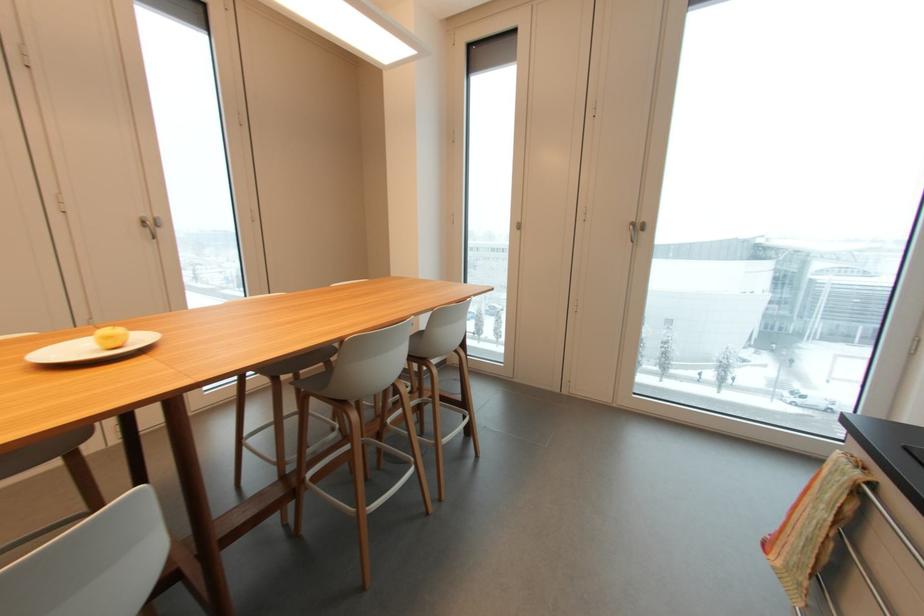
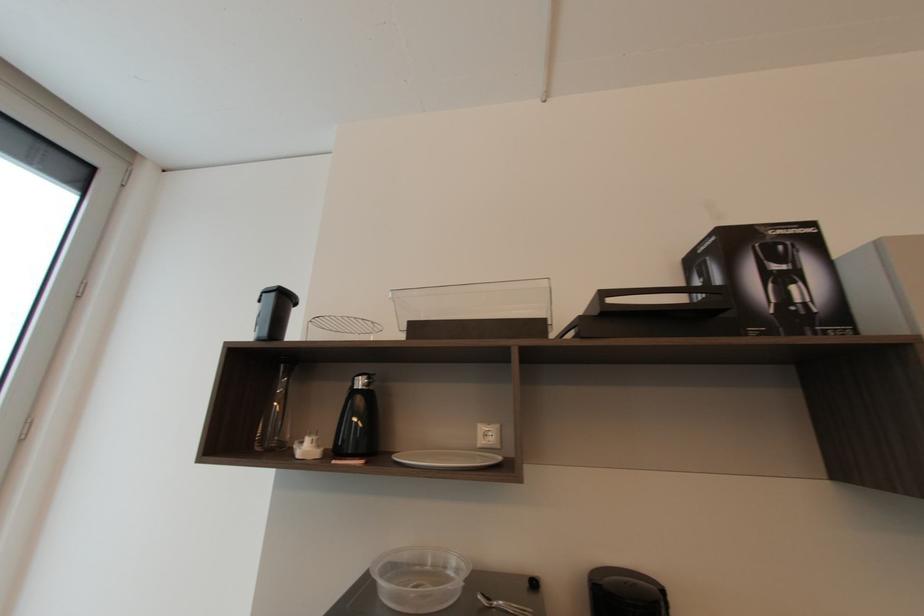
Question: The camera is either moving clockwise (left) or counter-clockwise (right) around the object. The first image is from the beginning of the video and the second image is from the end. Is the camera moving left or right when shooting the video?

Choices:
 (A) Left
 (B) Right

Answer: (A)